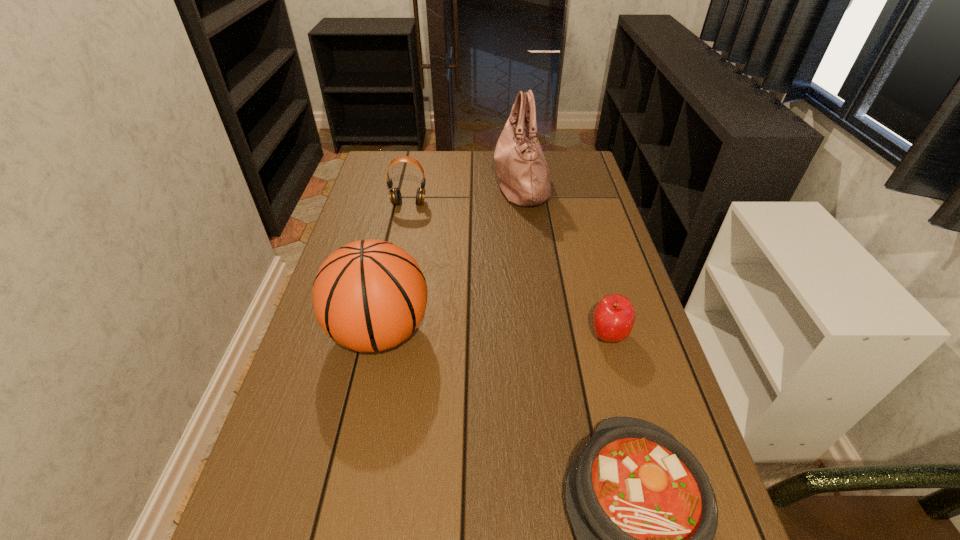
Find the location of a particular element. Image resolution: width=960 pixels, height=540 pixels. object that is at the far edge is located at coordinates (523, 175).

Find the location of a particular element. The width and height of the screenshot is (960, 540). basketball at the left edge is located at coordinates (370, 295).

At what (x,y) coordinates should I click in order to perform the action: click on headset positioned at the left edge. Please return your answer as a coordinate pair (x, y). Looking at the image, I should click on (395, 196).

Image resolution: width=960 pixels, height=540 pixels. I want to click on object located at the right edge, so click(x=613, y=319).

This screenshot has height=540, width=960. Identify the location of free location at the far edge. (470, 174).

Locate an element on the screen. vacant region at the left edge of the desktop is located at coordinates (300, 522).

This screenshot has width=960, height=540. In the image, there is a desktop. Find the location of `vacant region at the right edge`. vacant region at the right edge is located at coordinates (640, 308).

At what (x,y) coordinates should I click in order to perform the action: click on vacant space at the far right corner. Please return your answer as a coordinate pair (x, y). The image size is (960, 540). Looking at the image, I should click on (581, 157).

Find the location of `free spot between the handbag and the third shortest object`. free spot between the handbag and the third shortest object is located at coordinates pos(465,193).

You are a GUI agent. You are given a task and a screenshot of the screen. Output one action in this format:
    pyautogui.click(x=<x>, y=<y>)
    Task: Click on the free space between the tallest object and the basketball
    This screenshot has height=540, width=960.
    Given the screenshot: What is the action you would take?
    pyautogui.click(x=450, y=258)